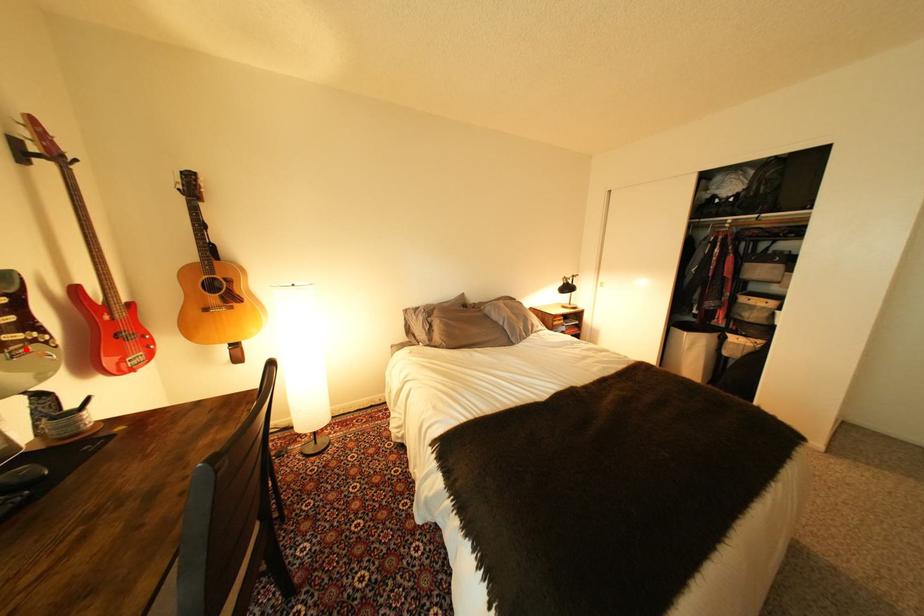
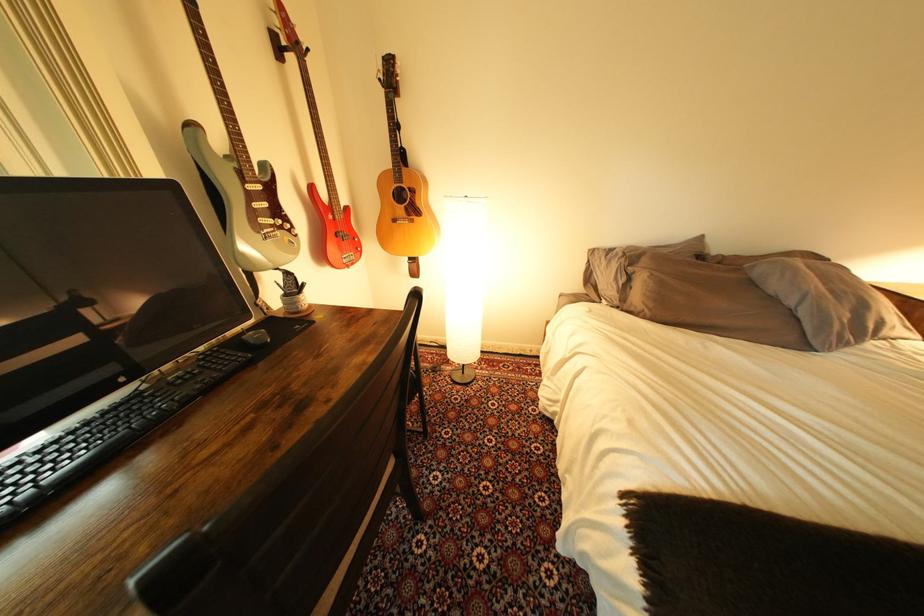
Question: I am providing you with two images of the same scene from different viewpoints. Given a red point in image1, look at the same physical point in image2. Is it:

Choices:
 (A) Closer to the viewpoint
 (B) Farther from the viewpoint

Answer: (A)